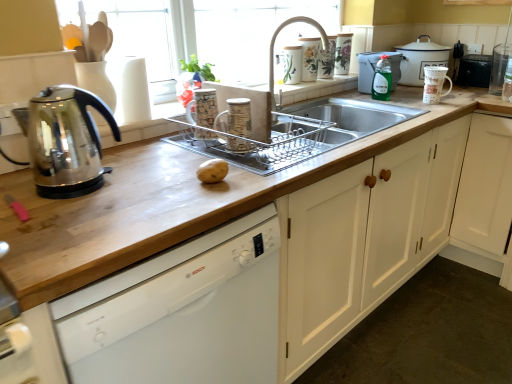
Identify the location of vacant space behind transparent glass kettle at left, the first kitchen appliance in the front-to-back sequence. The image size is (512, 384). (133, 154).